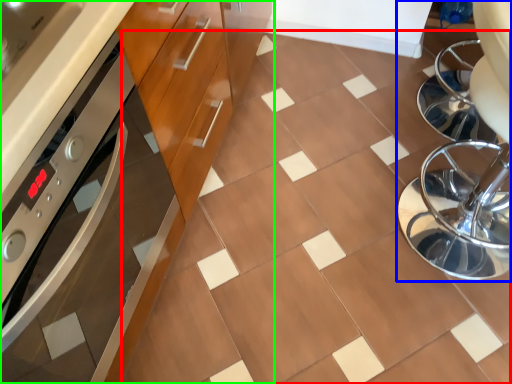
Question: Which object is positioned closest to ceramic tile (highlighted by a red box)? Select from swivel chair (highlighted by a blue box) and cabinetry (highlighted by a green box).

Choices:
 (A) swivel chair
 (B) cabinetry

Answer: (A)